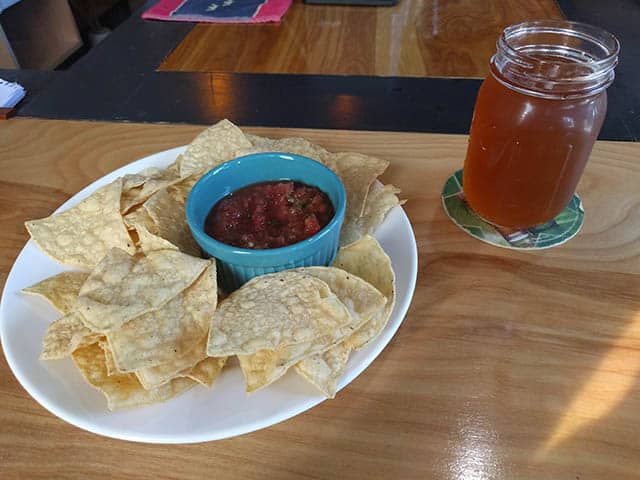
The height and width of the screenshot is (480, 640). In order to click on ramekin in this screenshot , I will do `click(250, 259)`.